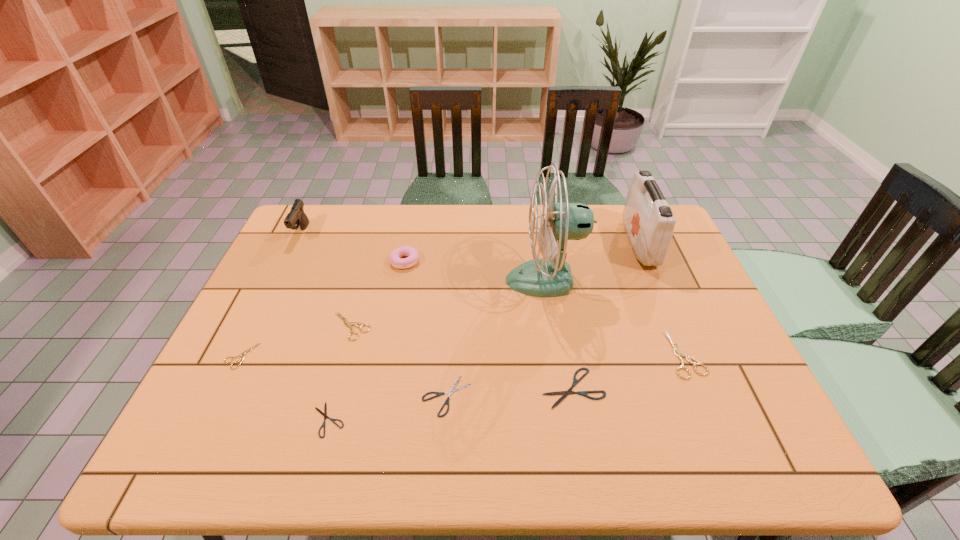
This screenshot has height=540, width=960. I want to click on empty space that is in between the first-aid kit and the smallest black shears, so click(x=484, y=332).

You are a GUI agent. You are given a task and a screenshot of the screen. Output one action in this format:
    pyautogui.click(x=<x>, y=<y>)
    Task: Click on the vacant space that's between the black pistol and the leftmost shears
    
    Given the screenshot: What is the action you would take?
    pyautogui.click(x=272, y=294)

Locate an element on the screen. empty location between the fifth shears from left to right and the leftmost beige shears is located at coordinates (407, 372).

Locate an element on the screen. Image resolution: width=960 pixels, height=540 pixels. free spot between the pistol and the fan is located at coordinates (423, 256).

Identify the location of free space between the tallest object and the leftmost beige shears. The height and width of the screenshot is (540, 960). tap(394, 318).

Locate an element on the screen. Image resolution: width=960 pixels, height=540 pixels. vacant area between the third tallest object and the biggest black shears is located at coordinates (437, 310).

Find the location of a particular element. This screenshot has height=540, width=960. empty location between the pistol and the fifth shears from left to right is located at coordinates (437, 310).

I want to click on vacant area between the leftmost beige shears and the red first-aid kit, so click(441, 299).

I want to click on blank region between the teal fan and the black pistol, so click(423, 256).

Identify which object is the ninth nearest to the shortest object. Please provide its 2D coordinates. Your answer should be formatted as a tuple, i.e. [(x, y)], where the tuple contains the x and y coordinates of a point satisfying the conditions above.

[(648, 220)]